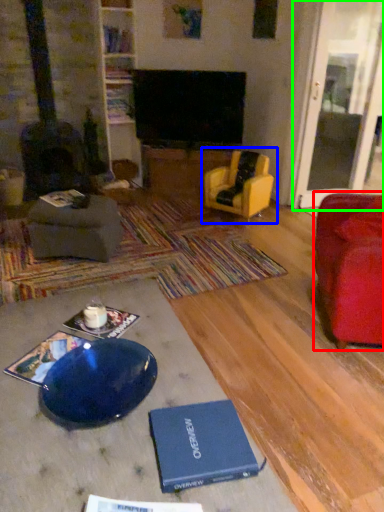
Question: Based on their relative distances, which object is nearer to chair (highlighted by a red box)? Choose from chair (highlighted by a blue box) and glass door (highlighted by a green box).

Choices:
 (A) chair
 (B) glass door

Answer: (A)